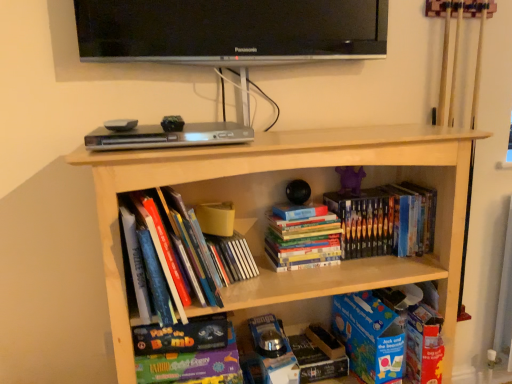
Question: Does black glossy television at upper center have a greater height compared to blue cardboard book at lower right?

Choices:
 (A) yes
 (B) no

Answer: (B)

Question: Is black glossy television at upper center bigger than blue cardboard book at lower right?

Choices:
 (A) no
 (B) yes

Answer: (B)

Question: Could you tell me if black glossy television at upper center is turned towards blue cardboard book at lower right?

Choices:
 (A) yes
 (B) no

Answer: (B)

Question: Considering the relative positions of black glossy television at upper center and blue cardboard book at lower right in the image provided, is black glossy television at upper center behind blue cardboard book at lower right?

Choices:
 (A) yes
 (B) no

Answer: (B)

Question: Considering the relative sizes of black glossy television at upper center and blue cardboard book at lower right in the image provided, is black glossy television at upper center shorter than blue cardboard book at lower right?

Choices:
 (A) no
 (B) yes

Answer: (B)

Question: From a real-world perspective, is black glossy television at upper center beneath blue cardboard book at lower right?

Choices:
 (A) yes
 (B) no

Answer: (B)

Question: Does matte board game at lower center, the 2th book from the left, have a smaller size compared to hardcover books at center, which is the first book from left to right?

Choices:
 (A) no
 (B) yes

Answer: (B)

Question: From the image's perspective, is matte board game at lower center, which is the 3th book in right-to-left order, on hardcover books at center, which is the 4th book in right-to-left order?

Choices:
 (A) yes
 (B) no

Answer: (B)

Question: Is matte board game at lower center, the 2th book from the left, shorter than hardcover books at center, which is the 4th book in right-to-left order?

Choices:
 (A) yes
 (B) no

Answer: (A)

Question: From a real-world perspective, is matte board game at lower center, which is the 3th book in right-to-left order, physically below hardcover books at center, which is the first book from left to right?

Choices:
 (A) yes
 (B) no

Answer: (A)

Question: Considering the relative positions of matte board game at lower center, the 2th book from the left, and hardcover books at center, which is the 4th book in right-to-left order, in the image provided, is matte board game at lower center, the 2th book from the left, in front of hardcover books at center, which is the 4th book in right-to-left order,?

Choices:
 (A) no
 (B) yes

Answer: (A)

Question: Would you say hardcover books at center, which is the 4th book in right-to-left order, is part of matte board game at lower center, the 2th book from the left,'s contents?

Choices:
 (A) no
 (B) yes

Answer: (A)

Question: Considering the relative positions of matte board game at lower center, which is the 3th book in right-to-left order, and blue cardboard book at lower right in the image provided, is matte board game at lower center, which is the 3th book in right-to-left order, to the right of blue cardboard book at lower right from the viewer's perspective?

Choices:
 (A) no
 (B) yes

Answer: (A)